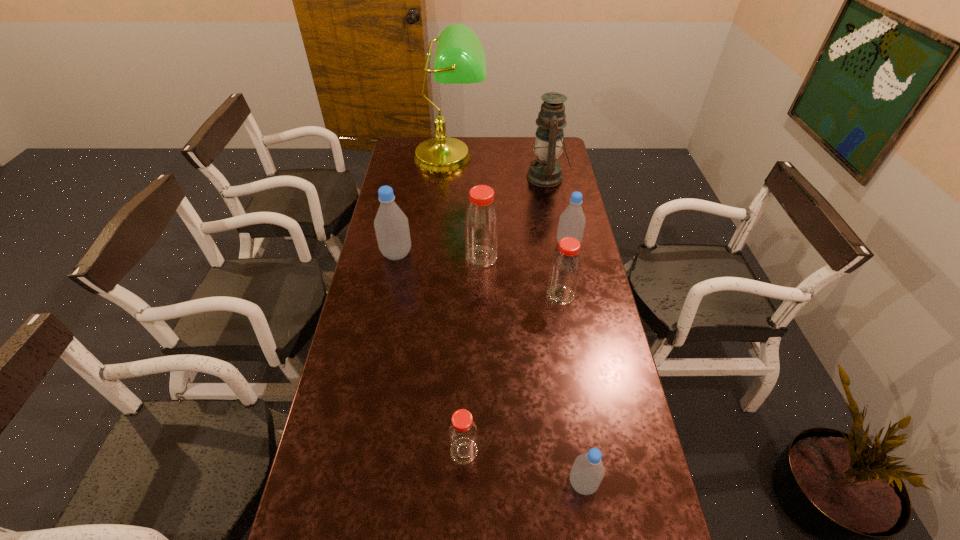
Find the location of a particular element. This screenshot has height=540, width=960. lamp is located at coordinates (460, 58).

Where is `green lamp`? green lamp is located at coordinates (460, 58).

The height and width of the screenshot is (540, 960). Identify the location of rust oil lamp. (545, 171).

Find the location of a particular element. the seventh shortest object is located at coordinates (545, 171).

Where is `the farthest red bottle`? The width and height of the screenshot is (960, 540). the farthest red bottle is located at coordinates (481, 223).

Locate an element on the screen. The width and height of the screenshot is (960, 540). the leftmost gray bottle is located at coordinates (391, 225).

Where is `the leftmost bottle`? Image resolution: width=960 pixels, height=540 pixels. the leftmost bottle is located at coordinates (391, 225).

Identify the location of the second nearest red bottle. The height and width of the screenshot is (540, 960). (x=565, y=267).

At what (x,y) coordinates should I click in order to perform the action: click on the rightmost red bottle. Please return your answer as a coordinate pair (x, y). Image resolution: width=960 pixels, height=540 pixels. Looking at the image, I should click on (565, 267).

Image resolution: width=960 pixels, height=540 pixels. Identify the location of the rightmost gray bottle. (572, 221).